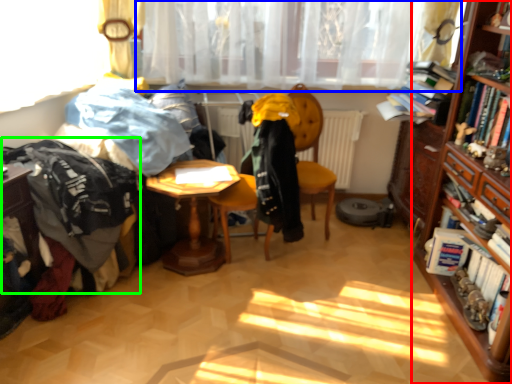
Question: Which object is positioned closest to bookcase (highlighted by a red box)? Select from curtain (highlighted by a blue box) and clothing (highlighted by a green box).

Choices:
 (A) curtain
 (B) clothing

Answer: (A)